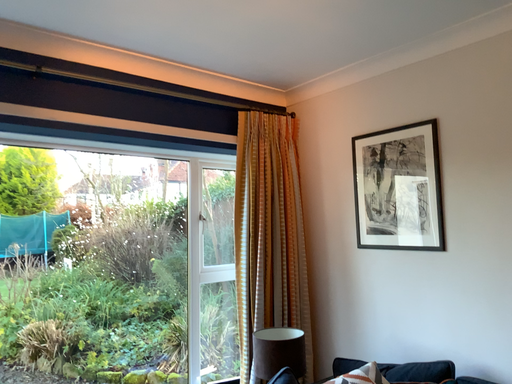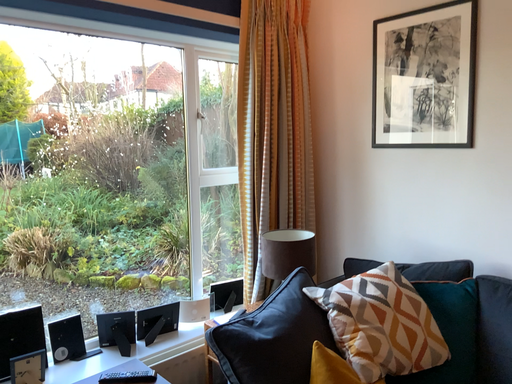
Question: Which way did the camera rotate in the video?

Choices:
 (A) rotated downward
 (B) rotated upward

Answer: (A)